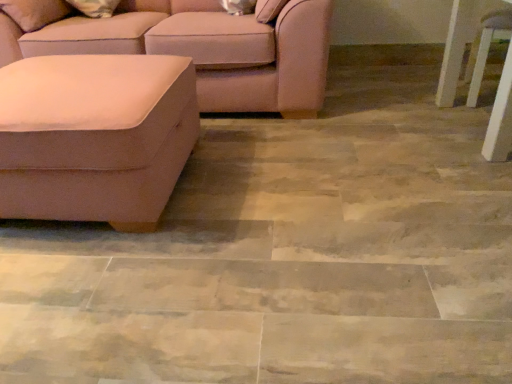
Measure the distance between suede-like beige ottoman at left, which ranks as the 1th studio couch in front-to-back order, and camera.

suede-like beige ottoman at left, which ranks as the 1th studio couch in front-to-back order, is 4.20 feet away from camera.

In order to face white glossy side table at right, should I rotate leftwards or rightwards?

To face it directly, rotate right by 31.464 degrees.

The image size is (512, 384). What do you see at coordinates (454, 51) in the screenshot?
I see `white glossy side table at right` at bounding box center [454, 51].

This screenshot has height=384, width=512. Find the location of `suede-like beige ottoman at left, positioned as the 2th studio couch in back-to-front order`. suede-like beige ottoman at left, positioned as the 2th studio couch in back-to-front order is located at coordinates (95, 137).

Consider the image. Is suede-like beige couch at left, which is counted as the first studio couch, starting from the back, oriented away from white glossy side table at right?

No, suede-like beige couch at left, which is counted as the first studio couch, starting from the back, is not facing away from white glossy side table at right.

Is suede-like beige couch at left, the 2th studio couch in the front-to-back sequence, far from white glossy side table at right?

Yes.

Which object is thinner, suede-like beige couch at left, the 2th studio couch in the front-to-back sequence, or white glossy side table at right?

With smaller width is white glossy side table at right.

This screenshot has height=384, width=512. I want to click on studio couch above the white glossy side table at right (from a real-world perspective), so click(204, 49).

Can you confirm if white glossy side table at right is bigger than suede-like beige couch at left, which is counted as the first studio couch, starting from the back?

Incorrect, white glossy side table at right is not larger than suede-like beige couch at left, which is counted as the first studio couch, starting from the back.

Is the position of white glossy side table at right less distant than that of suede-like beige couch at left, which is counted as the first studio couch, starting from the back?

Yes, the depth of white glossy side table at right is less than that of suede-like beige couch at left, which is counted as the first studio couch, starting from the back.

Could you tell me if white glossy side table at right is turned towards suede-like beige couch at left, which is counted as the first studio couch, starting from the back?

No, white glossy side table at right is not aimed at suede-like beige couch at left, which is counted as the first studio couch, starting from the back.

Is white glossy side table at right not inside suede-like beige couch at left, which is counted as the first studio couch, starting from the back?

Yes, white glossy side table at right is outside of suede-like beige couch at left, which is counted as the first studio couch, starting from the back.

Which is closer to the camera, (178,113) or (273,57)?

Point (178,113) is closer to the camera than point (273,57).

Is there a large distance between suede-like beige ottoman at left, which ranks as the 1th studio couch in front-to-back order, and suede-like beige couch at left, the 2th studio couch in the front-to-back sequence?

No, suede-like beige ottoman at left, which ranks as the 1th studio couch in front-to-back order, is in close proximity to suede-like beige couch at left, the 2th studio couch in the front-to-back sequence.

Looking at their sizes, would you say suede-like beige ottoman at left, positioned as the 2th studio couch in back-to-front order, is wider or thinner than suede-like beige couch at left, which is counted as the first studio couch, starting from the back?

In the image, suede-like beige ottoman at left, positioned as the 2th studio couch in back-to-front order, appears to be more narrow than suede-like beige couch at left, which is counted as the first studio couch, starting from the back.

From a real-world perspective, which object stands above the other?

suede-like beige couch at left, which is counted as the first studio couch, starting from the back.

Who is bigger, suede-like beige ottoman at left, positioned as the 2th studio couch in back-to-front order, or white glossy side table at right?

Bigger between the two is suede-like beige ottoman at left, positioned as the 2th studio couch in back-to-front order.

Considering the sizes of suede-like beige ottoman at left, positioned as the 2th studio couch in back-to-front order, and white glossy side table at right in the image, is suede-like beige ottoman at left, positioned as the 2th studio couch in back-to-front order, taller or shorter than white glossy side table at right?

In the image, suede-like beige ottoman at left, positioned as the 2th studio couch in back-to-front order, appears to be shorter than white glossy side table at right.

Between suede-like beige ottoman at left, positioned as the 2th studio couch in back-to-front order, and white glossy side table at right, which one is positioned behind?

white glossy side table at right.

Could you tell me if suede-like beige ottoman at left, positioned as the 2th studio couch in back-to-front order, is facing white glossy side table at right?

No.

Who is taller, white glossy side table at right or suede-like beige ottoman at left, which ranks as the 1th studio couch in front-to-back order?

white glossy side table at right is taller.

Considering the sizes of white glossy side table at right and suede-like beige ottoman at left, positioned as the 2th studio couch in back-to-front order, in the image, is white glossy side table at right bigger or smaller than suede-like beige ottoman at left, positioned as the 2th studio couch in back-to-front order,?

white glossy side table at right is smaller than suede-like beige ottoman at left, positioned as the 2th studio couch in back-to-front order.

Can you tell me how much white glossy side table at right and suede-like beige ottoman at left, which ranks as the 1th studio couch in front-to-back order, differ in facing direction?

There is a 2.82-degree angle between the facing directions of white glossy side table at right and suede-like beige ottoman at left, which ranks as the 1th studio couch in front-to-back order.

Is white glossy side table at right to the right of suede-like beige ottoman at left, which ranks as the 1th studio couch in front-to-back order, from the viewer's perspective?

Indeed, white glossy side table at right is positioned on the right side of suede-like beige ottoman at left, which ranks as the 1th studio couch in front-to-back order.

Considering the relative positions of suede-like beige couch at left, which is counted as the first studio couch, starting from the back, and suede-like beige ottoman at left, positioned as the 2th studio couch in back-to-front order, in the image provided, is suede-like beige couch at left, which is counted as the first studio couch, starting from the back, to the right of suede-like beige ottoman at left, positioned as the 2th studio couch in back-to-front order, from the viewer's perspective?

Correct, you'll find suede-like beige couch at left, which is counted as the first studio couch, starting from the back, to the right of suede-like beige ottoman at left, positioned as the 2th studio couch in back-to-front order.

You are a GUI agent. You are given a task and a screenshot of the screen. Output one action in this format:
    pyautogui.click(x=<x>, y=<y>)
    Task: Click on the studio couch above the suede-like beige ottoman at left, positioned as the 2th studio couch in back-to-front order (from the image's perspective)
    
    Given the screenshot: What is the action you would take?
    pyautogui.click(x=204, y=49)

Can you tell me how much suede-like beige couch at left, which is counted as the first studio couch, starting from the back, and suede-like beige ottoman at left, which ranks as the 1th studio couch in front-to-back order, differ in facing direction?

They differ by 0.00179 degrees in their facing directions.

Which of these two, suede-like beige couch at left, which is counted as the first studio couch, starting from the back, or suede-like beige ottoman at left, which ranks as the 1th studio couch in front-to-back order, is bigger?

suede-like beige couch at left, which is counted as the first studio couch, starting from the back, is bigger.

This screenshot has height=384, width=512. I want to click on studio couch that appears above the white glossy side table at right (from a real-world perspective), so click(204, 49).

Starting from the white glossy side table at right, which studio couch is the 1st one to the left? Please provide its 2D coordinates.

[(204, 49)]

From the image, which object appears to be nearer to suede-like beige couch at left, which is counted as the first studio couch, starting from the back, suede-like beige ottoman at left, positioned as the 2th studio couch in back-to-front order, or white glossy side table at right?

suede-like beige ottoman at left, positioned as the 2th studio couch in back-to-front order, is positioned closer to the anchor suede-like beige couch at left, which is counted as the first studio couch, starting from the back.

Estimate the real-world distances between objects in this image. Which object is closer to white glossy side table at right, suede-like beige couch at left, which is counted as the first studio couch, starting from the back, or suede-like beige ottoman at left, which ranks as the 1th studio couch in front-to-back order?

suede-like beige couch at left, which is counted as the first studio couch, starting from the back, is positioned closer to the anchor white glossy side table at right.

When comparing their distances from suede-like beige ottoman at left, which ranks as the 1th studio couch in front-to-back order, does white glossy side table at right or suede-like beige couch at left, the 2th studio couch in the front-to-back sequence, seem closer?

Based on the image, suede-like beige couch at left, the 2th studio couch in the front-to-back sequence, appears to be nearer to suede-like beige ottoman at left, which ranks as the 1th studio couch in front-to-back order.

When comparing their distances from suede-like beige couch at left, the 2th studio couch in the front-to-back sequence, does white glossy side table at right or suede-like beige ottoman at left, which ranks as the 1th studio couch in front-to-back order, seem further?

Based on the image, white glossy side table at right appears to be further to suede-like beige couch at left, the 2th studio couch in the front-to-back sequence.

Which object lies further to the anchor point suede-like beige ottoman at left, positioned as the 2th studio couch in back-to-front order, suede-like beige couch at left, which is counted as the first studio couch, starting from the back, or white glossy side table at right?

white glossy side table at right lies further to suede-like beige ottoman at left, positioned as the 2th studio couch in back-to-front order, than the other object.

From the image, which object appears to be farther from white glossy side table at right, suede-like beige ottoman at left, which ranks as the 1th studio couch in front-to-back order, or suede-like beige couch at left, the 2th studio couch in the front-to-back sequence?

suede-like beige ottoman at left, which ranks as the 1th studio couch in front-to-back order, is further to white glossy side table at right.

I want to click on studio couch between suede-like beige ottoman at left, which ranks as the 1th studio couch in front-to-back order, and white glossy side table at right, so click(x=204, y=49).